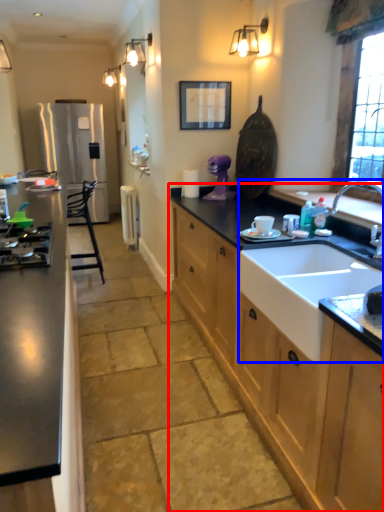
Question: Among these objects, which one is farthest to the camera, cabinetry (highlighted by a red box) or sink (highlighted by a blue box)?

Choices:
 (A) cabinetry
 (B) sink

Answer: (B)